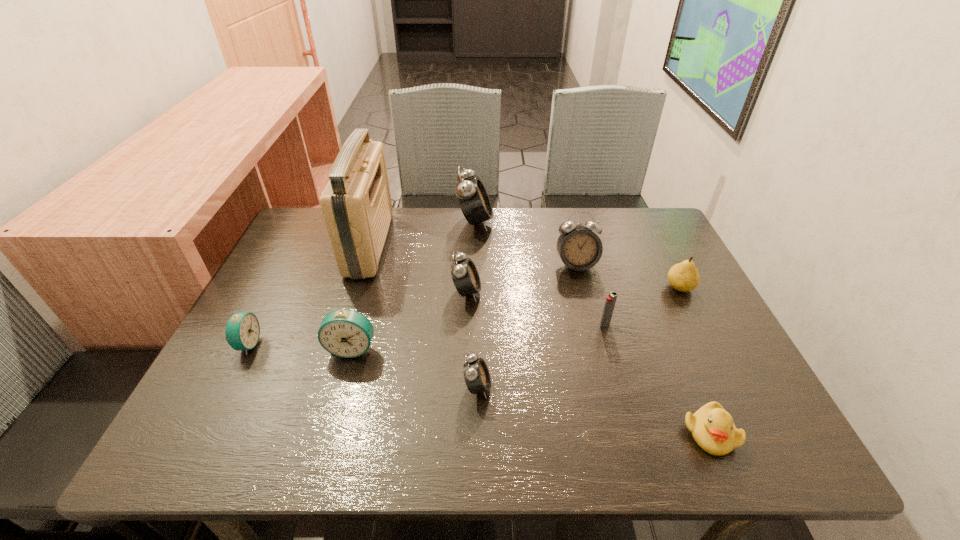
This screenshot has height=540, width=960. What are the coordinates of `free space that is in between the second biggest white alarm clock and the sixth farthest object` in the screenshot? It's located at (590, 295).

This screenshot has height=540, width=960. What are the coordinates of `free spot between the rightmost alarm clock and the ninth farthest object` in the screenshot? It's located at (527, 326).

In order to click on unoccupied area between the smaller blue alarm clock and the igniter in this screenshot , I will do `click(426, 334)`.

Find the location of a particular element. The image size is (960, 540). empty space between the beige radio receiver and the tallest alarm clock is located at coordinates (422, 233).

Where is `vacant area that lies between the fourth nearest alarm clock and the fifth nearest object`? The image size is (960, 540). vacant area that lies between the fourth nearest alarm clock and the fifth nearest object is located at coordinates (536, 308).

The width and height of the screenshot is (960, 540). I want to click on free spot between the third biggest white alarm clock and the sixth farthest object, so click(x=536, y=308).

Image resolution: width=960 pixels, height=540 pixels. What are the coordinates of `free point between the rightmost white alarm clock and the smallest white alarm clock` in the screenshot? It's located at (527, 326).

You are a GUI agent. You are given a task and a screenshot of the screen. Output one action in this format:
    pyautogui.click(x=<x>, y=<y>)
    Task: Click on the empty space between the pear and the igniter
    Image resolution: width=960 pixels, height=540 pixels.
    Given the screenshot: What is the action you would take?
    pyautogui.click(x=642, y=306)

Image resolution: width=960 pixels, height=540 pixels. What are the coordinates of `free area in between the nearest alarm clock and the rightmost white alarm clock` in the screenshot? It's located at (527, 326).

Locate an element on the screen. This screenshot has width=960, height=540. object that is the fourth closest to the smallest white alarm clock is located at coordinates (579, 248).